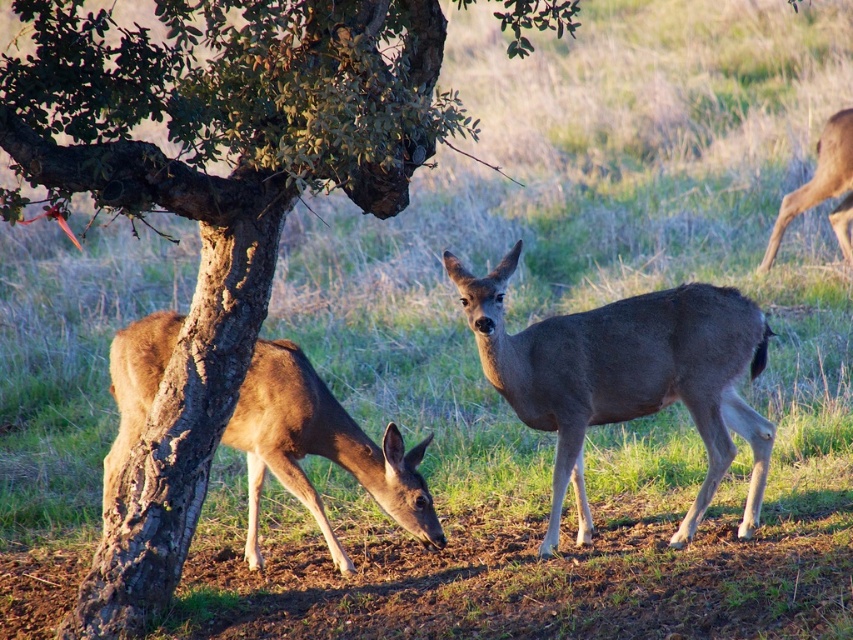
Question: Is smooth bark tree at center above gray matte deer at center?

Choices:
 (A) no
 (B) yes

Answer: (B)

Question: Which of the following is the closest to the observer?

Choices:
 (A) (282, 392)
 (B) (694, 385)

Answer: (B)

Question: Is smooth bark tree at center wider than gray matte deer at center?

Choices:
 (A) no
 (B) yes

Answer: (B)

Question: Which point is farther from the camera taking this photo?

Choices:
 (A) (315, 492)
 (B) (830, 128)

Answer: (B)

Question: In this image, where is smooth bark tree at center located relative to brown fur deer at lower left?

Choices:
 (A) right
 (B) left

Answer: (B)

Question: Which of the following is the closest to the observer?

Choices:
 (A) (842, 115)
 (B) (672, 371)
 (C) (102, 636)
 (D) (115, 358)

Answer: (C)